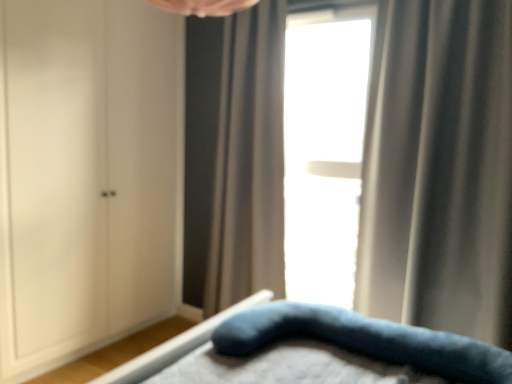
You are a GUI agent. You are given a task and a screenshot of the screen. Output one action in this format:
    pyautogui.click(x=<x>, y=<y>)
    Task: Click on the transparent glass window at center
    This screenshot has width=512, height=384.
    Given the screenshot: What is the action you would take?
    pyautogui.click(x=324, y=150)

Where is `gray textured curtain at center, arranged as the 2th curtain when viewed from the front`? This screenshot has width=512, height=384. gray textured curtain at center, arranged as the 2th curtain when viewed from the front is located at coordinates (234, 157).

Can we say gray textured curtain at center, the first curtain viewed from the left, lies outside velvety blue pillow at lower center?

Yes, gray textured curtain at center, the first curtain viewed from the left, is located beyond the bounds of velvety blue pillow at lower center.

Which is behind, gray textured curtain at center, the first curtain viewed from the left, or velvety blue pillow at lower center?

gray textured curtain at center, the first curtain viewed from the left, is more distant.

From a real-world perspective, between gray textured curtain at center, the first curtain viewed from the left, and velvety blue pillow at lower center, who is vertically higher?

From a 3D spatial view, gray textured curtain at center, the first curtain viewed from the left, is above.

Is velvety blue pillow at lower center outside of transparent glass window at center?

Absolutely, velvety blue pillow at lower center is external to transparent glass window at center.

Which object is wider, velvety blue pillow at lower center or transparent glass window at center?

With larger width is velvety blue pillow at lower center.

Is velvety blue pillow at lower center facing towards transparent glass window at center?

No, velvety blue pillow at lower center is not facing towards transparent glass window at center.

Would you say white matte cabinet at left is to the left or to the right of velvety blue pillow at lower center in the picture?

In the image, white matte cabinet at left appears on the left side of velvety blue pillow at lower center.

Looking at the image, does white matte cabinet at left seem bigger or smaller compared to velvety blue pillow at lower center?

In the image, white matte cabinet at left appears to be larger than velvety blue pillow at lower center.

Which is less distant, [180,24] or [168,357]?

Clearly, point [180,24] is more distant from the camera than point [168,357].

Considering the relative sizes of white matte cabinet at left and velvety blue pillow at lower center in the image provided, is white matte cabinet at left taller than velvety blue pillow at lower center?

Correct, white matte cabinet at left is much taller as velvety blue pillow at lower center.

Is white matte cabinet at left at the right side of silky gray curtain at right, placed as the second curtain when sorted from left to right?

No.

From a real-world perspective, is white matte cabinet at left below silky gray curtain at right, placed as the first curtain when sorted from front to back?

Yes, from a real-world perspective, white matte cabinet at left is beneath silky gray curtain at right, placed as the first curtain when sorted from front to back.

Image resolution: width=512 pixels, height=384 pixels. In order to click on curtain lying in front of the white matte cabinet at left in this screenshot , I will do `click(439, 169)`.

What's the angular difference between white matte cabinet at left and silky gray curtain at right, the 2th curtain from the back,'s facing directions?

white matte cabinet at left and silky gray curtain at right, the 2th curtain from the back, are facing 90 degrees away from each other.

From a real-world perspective, is velvety blue pillow at lower center above or below white matte cabinet at left?

In terms of real-world spatial position, velvety blue pillow at lower center is below white matte cabinet at left.

Who is bigger, velvety blue pillow at lower center or white matte cabinet at left?

With larger size is white matte cabinet at left.

Where is `dresser on the left of the velvety blue pillow at lower center`? Image resolution: width=512 pixels, height=384 pixels. dresser on the left of the velvety blue pillow at lower center is located at coordinates (87, 176).

What's the angular difference between velvety blue pillow at lower center and silky gray curtain at right, the 2th curtain from the back,'s facing directions?

The facing directions of velvety blue pillow at lower center and silky gray curtain at right, the 2th curtain from the back, are 88.4 degrees apart.

Looking at this image, considering the positions of objects velvety blue pillow at lower center and silky gray curtain at right, placed as the second curtain when sorted from left to right, in the image provided, who is more to the right, velvety blue pillow at lower center or silky gray curtain at right, placed as the second curtain when sorted from left to right,?

Positioned to the right is silky gray curtain at right, placed as the second curtain when sorted from left to right.

Choose the correct answer: Is velvety blue pillow at lower center inside silky gray curtain at right, the 2th curtain from the back, or outside it?

velvety blue pillow at lower center cannot be found inside silky gray curtain at right, the 2th curtain from the back.

From a real-world perspective, which is physically above, velvety blue pillow at lower center or silky gray curtain at right, placed as the second curtain when sorted from left to right?

silky gray curtain at right, placed as the second curtain when sorted from left to right, is physically above.

Is gray textured curtain at center, the first curtain when ordered from back to front, positioned with its back to white matte cabinet at left?

No, gray textured curtain at center, the first curtain when ordered from back to front, is not facing the opposite direction of white matte cabinet at left.

In the scene shown: Considering the sizes of objects gray textured curtain at center, which is counted as the 2th curtain, starting from the right, and white matte cabinet at left in the image provided, who is shorter, gray textured curtain at center, which is counted as the 2th curtain, starting from the right, or white matte cabinet at left?

gray textured curtain at center, which is counted as the 2th curtain, starting from the right, is shorter.

From the image's perspective, which one is positioned higher, gray textured curtain at center, arranged as the 2th curtain when viewed from the front, or white matte cabinet at left?

white matte cabinet at left appears higher in the image.

From the image's perspective, starting from the velvety blue pillow at lower center, which curtain is the 1st one above? Please provide its 2D coordinates.

[(234, 157)]

Image resolution: width=512 pixels, height=384 pixels. I want to click on bed located below the transparent glass window at center (from the image's perspective), so click(x=314, y=351).

Which object lies nearer to the anchor point velvety blue pillow at lower center, transparent glass window at center or gray textured curtain at center, arranged as the 2th curtain when viewed from the front?

gray textured curtain at center, arranged as the 2th curtain when viewed from the front, is closer to velvety blue pillow at lower center.

Consider the image. Based on their spatial positions, is gray textured curtain at center, which is counted as the 2th curtain, starting from the right, or velvety blue pillow at lower center closer to transparent glass window at center?

gray textured curtain at center, which is counted as the 2th curtain, starting from the right.

Looking at the image, which one is located closer to gray textured curtain at center, the first curtain viewed from the left, velvety blue pillow at lower center or transparent glass window at center?

transparent glass window at center.

Based on their spatial positions, is silky gray curtain at right, the first curtain from the right, or white matte cabinet at left closer to velvety blue pillow at lower center?

silky gray curtain at right, the first curtain from the right, is closer to velvety blue pillow at lower center.

Estimate the real-world distances between objects in this image. Which object is closer to gray textured curtain at center, the first curtain when ordered from back to front, transparent glass window at center or silky gray curtain at right, placed as the second curtain when sorted from left to right?

transparent glass window at center lies closer to gray textured curtain at center, the first curtain when ordered from back to front, than the other object.

Consider the image. Based on their spatial positions, is transparent glass window at center or velvety blue pillow at lower center further from silky gray curtain at right, the 2th curtain from the back?

velvety blue pillow at lower center is further to silky gray curtain at right, the 2th curtain from the back.

From the image, which object appears to be farther from silky gray curtain at right, placed as the second curtain when sorted from left to right, velvety blue pillow at lower center or gray textured curtain at center, which is counted as the 2th curtain, starting from the right?

Based on the image, gray textured curtain at center, which is counted as the 2th curtain, starting from the right, appears to be further to silky gray curtain at right, placed as the second curtain when sorted from left to right.

Which object lies nearer to the anchor point gray textured curtain at center, the first curtain when ordered from back to front, white matte cabinet at left or transparent glass window at center?

transparent glass window at center is positioned closer to the anchor gray textured curtain at center, the first curtain when ordered from back to front.

Where is `window located between white matte cabinet at left and silky gray curtain at right, the 2th curtain from the back, in the left-right direction`? This screenshot has height=384, width=512. window located between white matte cabinet at left and silky gray curtain at right, the 2th curtain from the back, in the left-right direction is located at coordinates (324, 150).

Locate an element on the screen. This screenshot has width=512, height=384. curtain between white matte cabinet at left and transparent glass window at center in the horizontal direction is located at coordinates (234, 157).

Where is `dresser located between velvety blue pillow at lower center and gray textured curtain at center, the first curtain when ordered from back to front, in the depth direction`? dresser located between velvety blue pillow at lower center and gray textured curtain at center, the first curtain when ordered from back to front, in the depth direction is located at coordinates (87, 176).

The image size is (512, 384). Identify the location of curtain between velvety blue pillow at lower center and gray textured curtain at center, arranged as the 2th curtain when viewed from the front, along the z-axis. (439, 169).